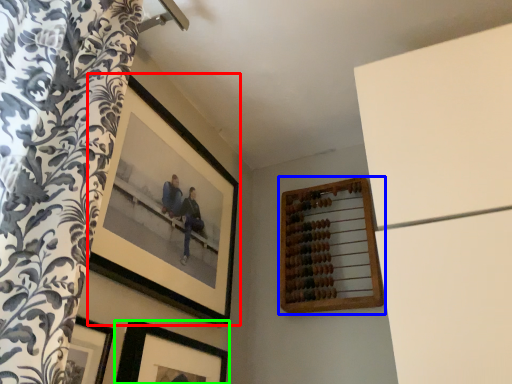
Question: Estimate the real-world distances between objects in this image. Which object is farther from picture frame (highlighted by a red box), picture frame (highlighted by a blue box) or picture frame (highlighted by a green box)?

Choices:
 (A) picture frame
 (B) picture frame

Answer: (A)